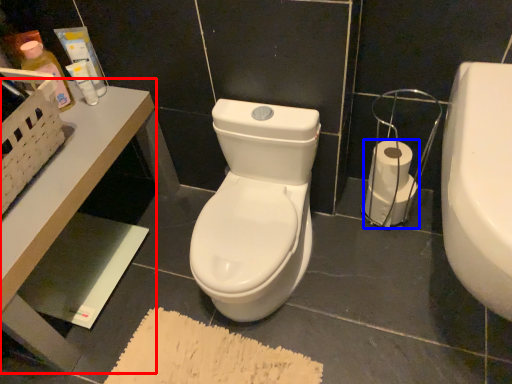
Question: Which of the following is the farthest to the observer, table (highlighted by a red box) or toilet paper (highlighted by a blue box)?

Choices:
 (A) table
 (B) toilet paper

Answer: (B)